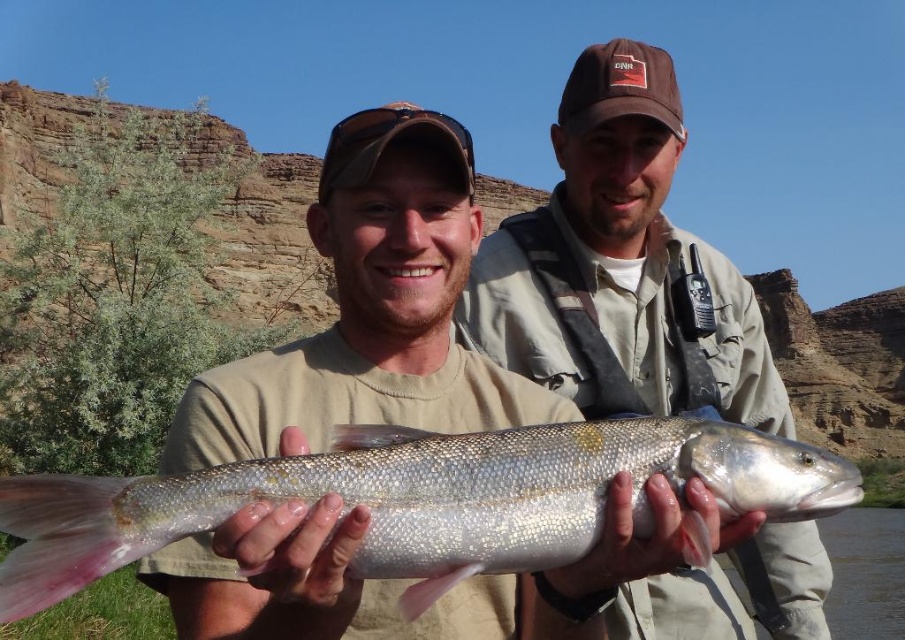
Who is taller, shiny metallic fish at center or shiny silver fish at center?

Standing taller between the two is shiny metallic fish at center.

This screenshot has width=905, height=640. Identify the location of shiny metallic fish at center. (621, 268).

The height and width of the screenshot is (640, 905). Find the location of `shiny metallic fish at center`. shiny metallic fish at center is located at coordinates (621, 268).

Where is `shiny metallic fish at center`? The image size is (905, 640). shiny metallic fish at center is located at coordinates (621, 268).

Is point (437, 170) closer to camera compared to point (132, 548)?

No, it is behind (132, 548).

Describe the element at coordinates (370, 308) in the screenshot. I see `matte beige shirt at center` at that location.

This screenshot has width=905, height=640. Find the location of `matte beige shirt at center`. matte beige shirt at center is located at coordinates (370, 308).

Which is in front, point (332, 195) or point (586, 314)?

Point (332, 195) is in front.

Who is more distant from viewer, (458, 218) or (567, 136)?

Positioned behind is point (567, 136).

Who is more forward, (315, 576) or (656, 365)?

Point (315, 576) is more forward.

Image resolution: width=905 pixels, height=640 pixels. Identify the location of matte beige shirt at center. (370, 308).